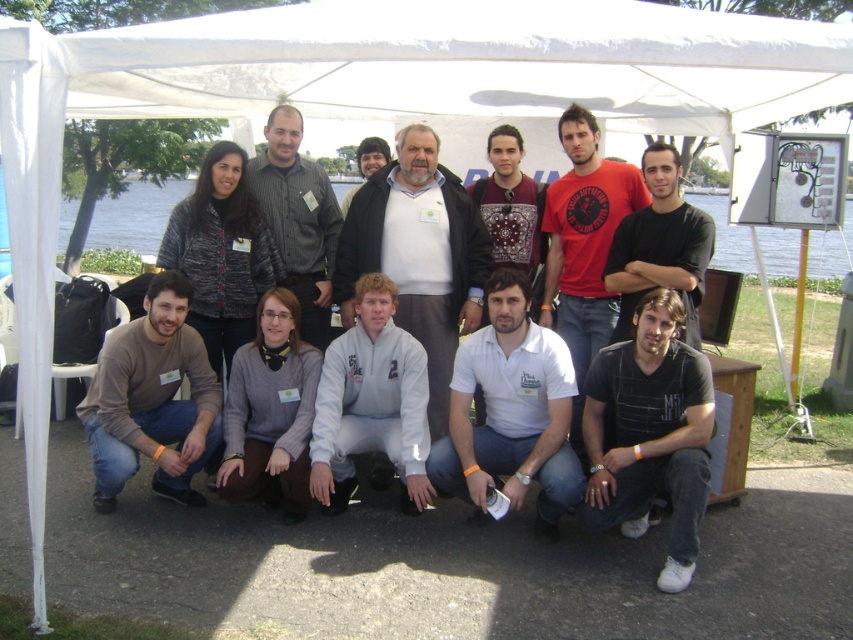
Question: Is brown textured sweater at lower left bigger than matte white shirt at center?

Choices:
 (A) no
 (B) yes

Answer: (B)

Question: Which point is farther from the camera taking this photo?

Choices:
 (A) (299, 282)
 (B) (347, 202)
 (C) (590, 225)

Answer: (B)

Question: Can you confirm if gray fleece jacket at center is thinner than matte white shirt at center?

Choices:
 (A) no
 (B) yes

Answer: (A)

Question: Which point is farther to the camera?

Choices:
 (A) (695, 294)
 (B) (585, 156)
 (C) (364, 170)

Answer: (C)

Question: Which object is positioned farthest from the brown textured sweater at lower left?

Choices:
 (A) gray shirt at center
 (B) gray fleece jacket at center

Answer: (A)

Question: Observing the image, what is the correct spatial positioning of matte red t-shirt at center in reference to gray shirt at center?

Choices:
 (A) below
 (B) above

Answer: (A)